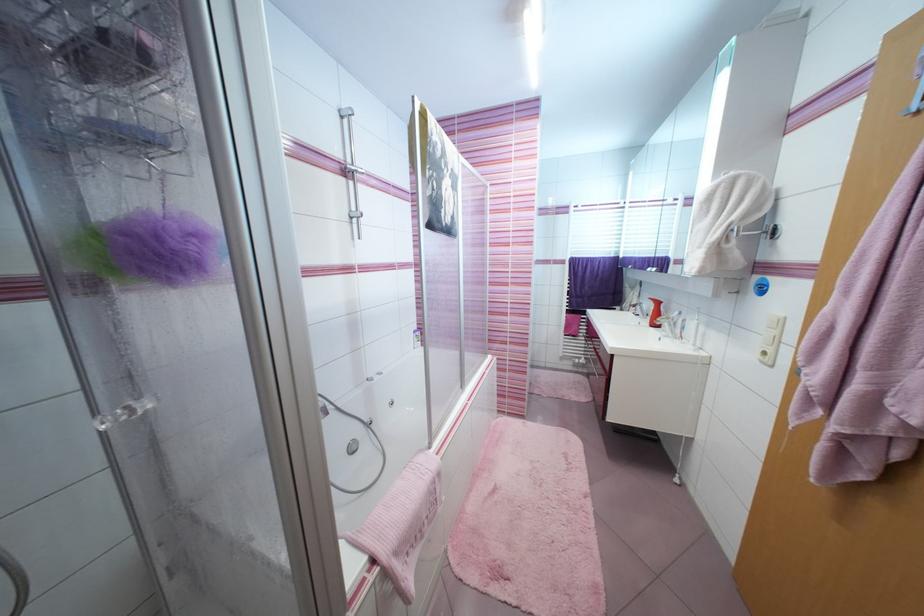
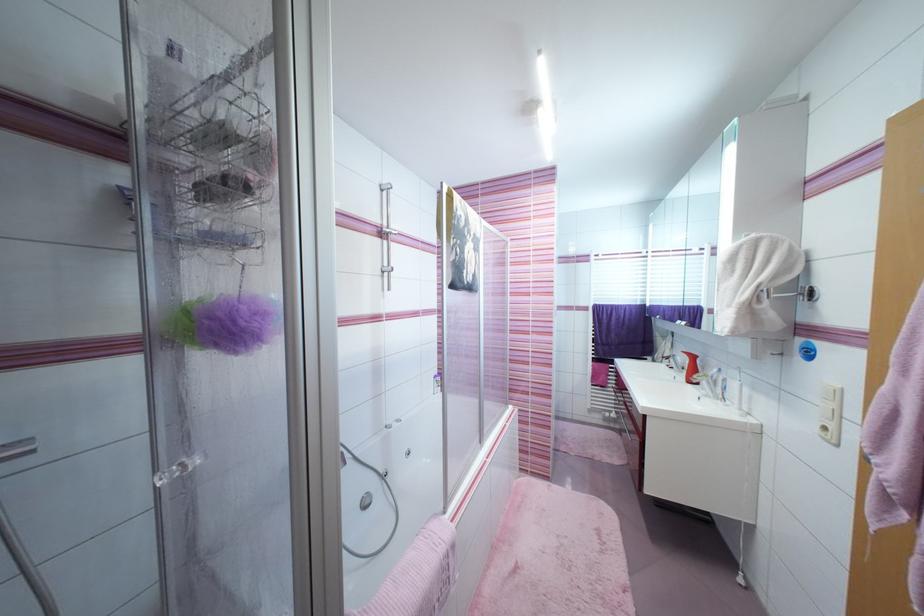
Locate, in the second image, the point that corresponds to (x=689, y=322) in the first image.

(730, 381)